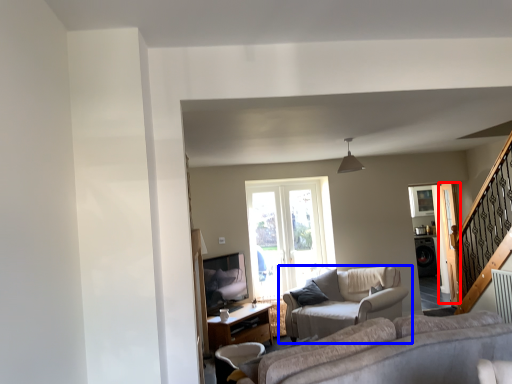
Question: Which object appears farthest to the camera in this image, screen door (highlighted by a red box) or studio couch (highlighted by a blue box)?

Choices:
 (A) screen door
 (B) studio couch

Answer: (A)